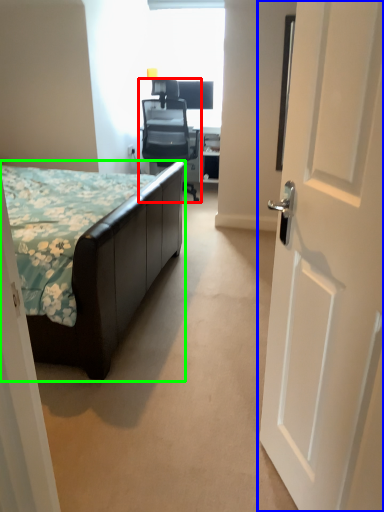
Question: Which is farther away from chair (highlighted by a red box)? door (highlighted by a blue box) or bed (highlighted by a green box)?

Choices:
 (A) door
 (B) bed

Answer: (A)